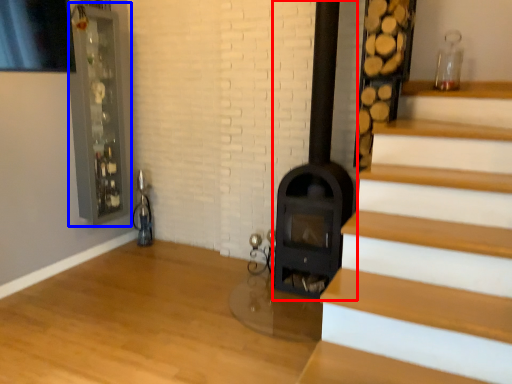
Question: Which object appears closest to the camera in this image, fireplace (highlighted by a red box) or glass door (highlighted by a blue box)?

Choices:
 (A) fireplace
 (B) glass door

Answer: (A)